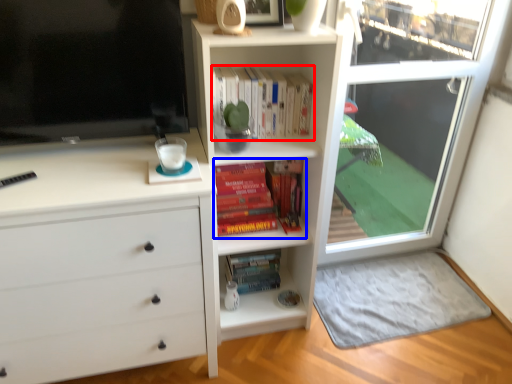
Question: Which object is further to the camera taking this photo, book (highlighted by a red box) or book (highlighted by a blue box)?

Choices:
 (A) book
 (B) book

Answer: (B)